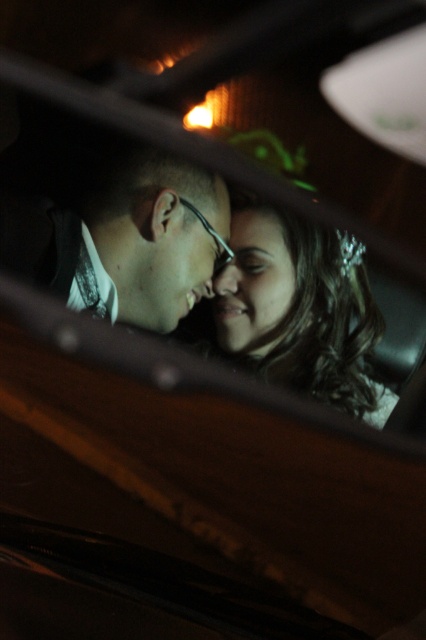
Question: Does matte black glasses at center appear on the left side of smooth skin face at center?

Choices:
 (A) yes
 (B) no

Answer: (A)

Question: Is matte black hair at center behind smooth skin face at center?

Choices:
 (A) yes
 (B) no

Answer: (B)

Question: Which point appears closest to the camera in this image?

Choices:
 (A) (221, 308)
 (B) (196, 253)
 (C) (226, 196)
 (D) (161, 269)

Answer: (B)

Question: Considering the real-world distances, which object is farthest from the matte black glasses at center?

Choices:
 (A) smooth skin face at center
 (B) matte black forehead at center

Answer: (A)

Question: Which point is farther to the camera?

Choices:
 (A) (350, 275)
 (B) (147, 154)

Answer: (A)

Question: Is matte black glasses at center positioned at the back of smooth skin face at center?

Choices:
 (A) yes
 (B) no

Answer: (A)